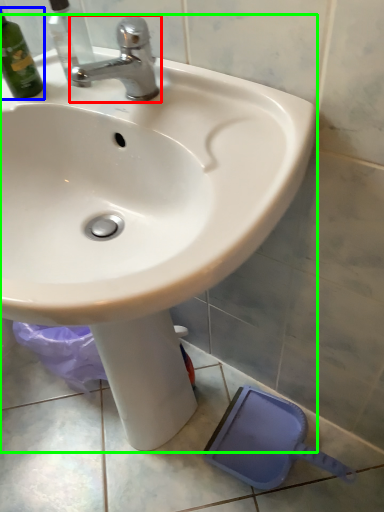
Question: Considering the real-world distances, which object is closest to tap (highlighted by a red box)? bottle (highlighted by a blue box) or sink (highlighted by a green box).

Choices:
 (A) bottle
 (B) sink

Answer: (A)